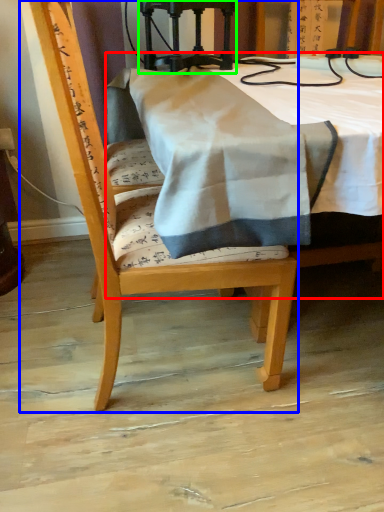
Question: Which object is the closest to the table (highlighted by a red box)? Choose among these: chair (highlighted by a blue box) or equipment (highlighted by a green box).

Choices:
 (A) chair
 (B) equipment

Answer: (B)